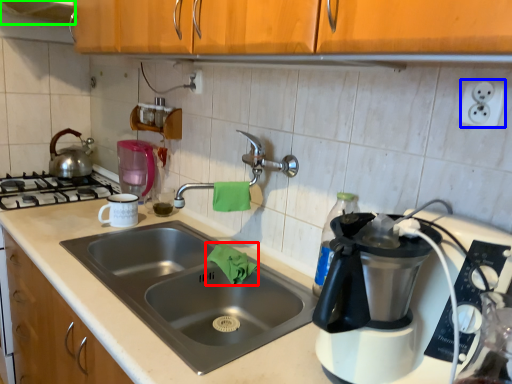
Question: Which is nearer to the material (highlighted by a red box)? electric outlet (highlighted by a blue box) or exhaust hood (highlighted by a green box).

Choices:
 (A) electric outlet
 (B) exhaust hood

Answer: (A)